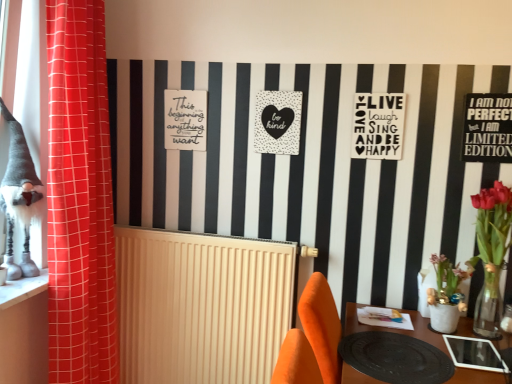
Measure the distance between point (497, 375) and camera.

Point (497, 375) is 1.38 meters from camera.

At what (x,y) coordinates should I click in order to perform the action: click on red fabric curtain at left. Please return your answer as a coordinate pair (x, y). This screenshot has width=512, height=384. Looking at the image, I should click on (80, 198).

The width and height of the screenshot is (512, 384). Find the location of `white stone window sill at lower left`. white stone window sill at lower left is located at coordinates (22, 289).

At what (x,y) coordinates should I click in order to perform the action: click on white matte poster at upper center, marked as the 2th postcard in a left-to-right arrangement. Please return your answer as a coordinate pair (x, y). The height and width of the screenshot is (384, 512). Looking at the image, I should click on (378, 126).

Where is `black matte sign at upper right, the third postcard in the back-to-front sequence`? The image size is (512, 384). black matte sign at upper right, the third postcard in the back-to-front sequence is located at coordinates (488, 128).

The height and width of the screenshot is (384, 512). Describe the element at coordinates (185, 120) in the screenshot. I see `matte white sign at upper left` at that location.

Image resolution: width=512 pixels, height=384 pixels. What are the coordinates of `matte white sign at upper left` in the screenshot? It's located at (185, 120).

What are the coordinates of `black matte table at lower right` in the screenshot? It's located at (395, 329).

Is there a large distance between red fabric curtain at left and white ribbed radiator at center?

Actually, red fabric curtain at left and white ribbed radiator at center are a little close together.

From the image's perspective, does red fabric curtain at left appear lower than white ribbed radiator at center?

Actually, red fabric curtain at left appears above white ribbed radiator at center in the image.

Considering the relative positions of red fabric curtain at left and white ribbed radiator at center in the image provided, is red fabric curtain at left to the left of white ribbed radiator at center from the viewer's perspective?

Correct, you'll find red fabric curtain at left to the left of white ribbed radiator at center.

From a real-world perspective, is red fabric curtain at left located beneath white ribbed radiator at center?

No, from a real-world perspective, red fabric curtain at left is not below white ribbed radiator at center.

Locate an element on the screen. Image resolution: width=512 pixels, height=384 pixels. curtain below the matte white sign at upper left (from a real-world perspective) is located at coordinates (80, 198).

Which object is more forward, matte white sign at upper left or red fabric curtain at left?

red fabric curtain at left is more forward.

Is matte white sign at upper left facing towards red fabric curtain at left?

No, matte white sign at upper left is not facing towards red fabric curtain at left.

Consider the image. Is the surface of matte white sign at upper left in direct contact with red fabric curtain at left?

There is a gap between matte white sign at upper left and red fabric curtain at left.

From a real-world perspective, between matte white sign at upper left and white matte poster at upper center, positioned as the second postcard in right-to-left order, who is vertically lower?

matte white sign at upper left.

Based on the photo, could you tell me if matte white sign at upper left is facing white matte poster at upper center, which appears as the 2th postcard when viewed from the front?

No, matte white sign at upper left does not turn towards white matte poster at upper center, which appears as the 2th postcard when viewed from the front.

This screenshot has height=384, width=512. I want to click on postcard that is the 2nd one when counting downward from the matte white sign at upper left (from the image's perspective), so click(x=378, y=126).

From the image's perspective, which one is positioned higher, matte white sign at upper left or white matte poster at upper center, positioned as the second postcard in right-to-left order?

From the image's view, matte white sign at upper left is above.

Which object is more forward, white ribbed radiator at center or white stone window sill at lower left?

Positioned in front is white stone window sill at lower left.

Identify the location of radiator that appears below the white stone window sill at lower left (from the image's perspective). This screenshot has height=384, width=512. (201, 305).

Is white stone window sill at lower left at the back of white ribbed radiator at center?

white ribbed radiator at center is not turned away from white stone window sill at lower left.

Is white matte poster at upper center, which ranks as the 2th postcard in back-to-front order, directly adjacent to black matte table at lower right?

No, white matte poster at upper center, which ranks as the 2th postcard in back-to-front order, is not making contact with black matte table at lower right.

How far apart are white matte poster at upper center, marked as the 2th postcard in a left-to-right arrangement, and black matte table at lower right?

white matte poster at upper center, marked as the 2th postcard in a left-to-right arrangement, is 75.84 centimeters away from black matte table at lower right.

Is white matte poster at upper center, which ranks as the 2th postcard in back-to-front order, shorter than black matte table at lower right?

Correct, white matte poster at upper center, which ranks as the 2th postcard in back-to-front order, is not as tall as black matte table at lower right.

From a real-world perspective, is white matte poster at upper center, positioned as the second postcard in right-to-left order, physically located above or below black matte table at lower right?

white matte poster at upper center, positioned as the second postcard in right-to-left order, is situated higher than black matte table at lower right in the real world.

How many degrees apart are the facing directions of black dotted heart at center, the 1th postcard from the left, and matte white sign at upper left?

The facing directions of black dotted heart at center, the 1th postcard from the left, and matte white sign at upper left are 0.0373 degrees apart.

Which of these two, black dotted heart at center, the 1th postcard in the back-to-front sequence, or matte white sign at upper left, is bigger?

black dotted heart at center, the 1th postcard in the back-to-front sequence, is bigger.

Would you say black dotted heart at center, the 1th postcard from the left, is to the left or to the right of matte white sign at upper left in the picture?

From the image, it's evident that black dotted heart at center, the 1th postcard from the left, is to the right of matte white sign at upper left.

From the picture: Which is closer to the camera, (31,280) or (242,357)?

Point (31,280).

Considering the relative sizes of white stone window sill at lower left and white ribbed radiator at center in the image provided, is white stone window sill at lower left wider than white ribbed radiator at center?

Yes.

Who is smaller, white stone window sill at lower left or white ribbed radiator at center?

Smaller between the two is white stone window sill at lower left.

Are white stone window sill at lower left and white ribbed radiator at center located far from each other?

No, there isn't a large distance between white stone window sill at lower left and white ribbed radiator at center.

Locate an element on the screen. radiator below the red fabric curtain at left (from a real-world perspective) is located at coordinates (201, 305).

The width and height of the screenshot is (512, 384). In order to click on writing behind the red fabric curtain at left in this screenshot , I will do `click(185, 120)`.

Based on their spatial positions, is white ribbed radiator at center or black matte sign at upper right, the third postcard in the back-to-front sequence, closer to gray fabric gnome at left?

white ribbed radiator at center lies closer to gray fabric gnome at left than the other object.

When comparing their distances from white ribbed radiator at center, does white stone window sill at lower left or gray fabric gnome at left seem closer?

white stone window sill at lower left is closer to white ribbed radiator at center.

When comparing their distances from matte white sign at upper left, does black dotted heart at center, the 1th postcard from the left, or black matte table at lower right seem closer?

Based on the image, black dotted heart at center, the 1th postcard from the left, appears to be nearer to matte white sign at upper left.

From the image, which object appears to be nearer to white matte poster at upper center, positioned as the second postcard in right-to-left order, matte white sign at upper left or white ribbed radiator at center?

Based on the image, matte white sign at upper left appears to be nearer to white matte poster at upper center, positioned as the second postcard in right-to-left order.

From the picture: When comparing their distances from black dotted heart at center, the 1th postcard from the left, does white matte poster at upper center, positioned as the second postcard in right-to-left order, or black matte table at lower right seem closer?

white matte poster at upper center, positioned as the second postcard in right-to-left order, lies closer to black dotted heart at center, the 1th postcard from the left, than the other object.

Based on their spatial positions, is white matte poster at upper center, which appears as the 2th postcard when viewed from the front, or gray fabric gnome at left closer to white stone window sill at lower left?

gray fabric gnome at left lies closer to white stone window sill at lower left than the other object.

Which object lies nearer to the anchor point matte white sign at upper left, black matte sign at upper right, the third postcard in the back-to-front sequence, or black dotted heart at center, the 1th postcard in the back-to-front sequence?

The object closer to matte white sign at upper left is black dotted heart at center, the 1th postcard in the back-to-front sequence.

Looking at the image, which one is located closer to white matte poster at upper center, marked as the 2th postcard in a left-to-right arrangement, red fabric curtain at left or black matte table at lower right?

black matte table at lower right lies closer to white matte poster at upper center, marked as the 2th postcard in a left-to-right arrangement, than the other object.

The image size is (512, 384). In order to click on animal situated between white stone window sill at lower left and white ribbed radiator at center from left to right in this screenshot , I will do `click(19, 195)`.

Find the location of a particular element. writing between white stone window sill at lower left and white matte poster at upper center, marked as the 2th postcard in a left-to-right arrangement is located at coordinates (185, 120).

At what (x,y) coordinates should I click in order to perform the action: click on writing located between gray fabric gnome at left and black matte sign at upper right, placed as the 1th postcard when sorted from front to back, in the left-right direction. Please return your answer as a coordinate pair (x, y). The image size is (512, 384). Looking at the image, I should click on (185, 120).

Locate an element on the screen. This screenshot has width=512, height=384. radiator between gray fabric gnome at left and black matte table at lower right is located at coordinates (201, 305).